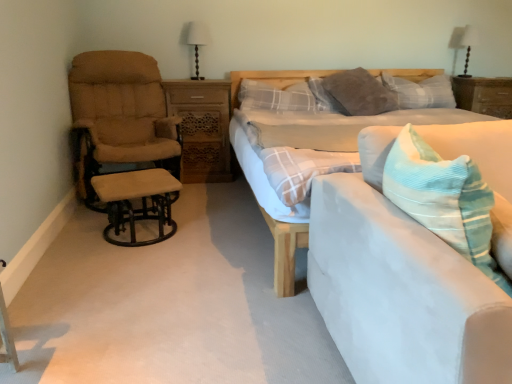
At what (x,y) coordinates should I click in order to perform the action: click on free location to the right of beige fabric recliner at left. Please return your answer as a coordinate pair (x, y). Looking at the image, I should click on (204, 201).